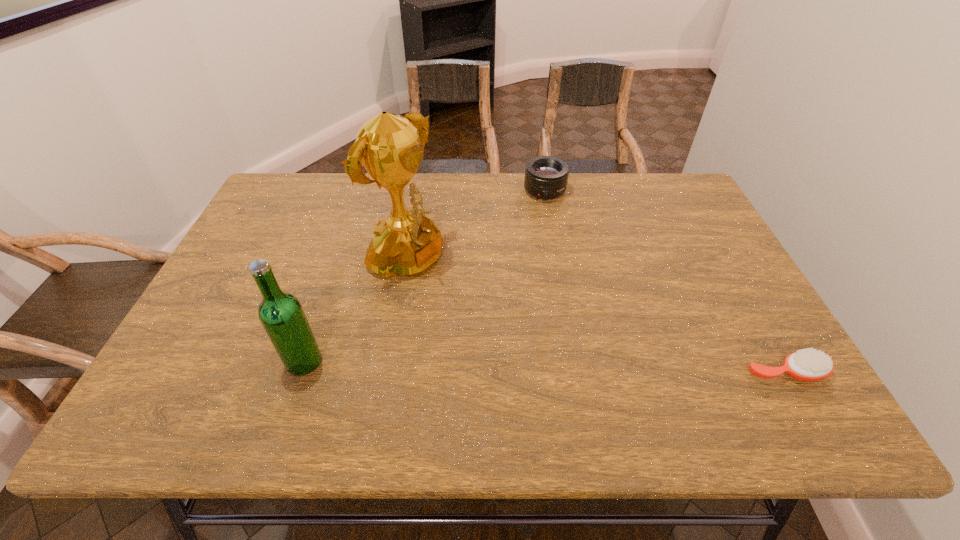
Find the location of a particular element. The image size is (960, 540). free space on the desktop that is between the leftmost object and the hairbrush and is positioned on the front side of the tallest object is located at coordinates (591, 368).

The height and width of the screenshot is (540, 960). Identify the location of free space on the desktop that is between the leftmost object and the hairbrush and is positioned on the side of the second object from right to left with brand markings and control switches. (594, 368).